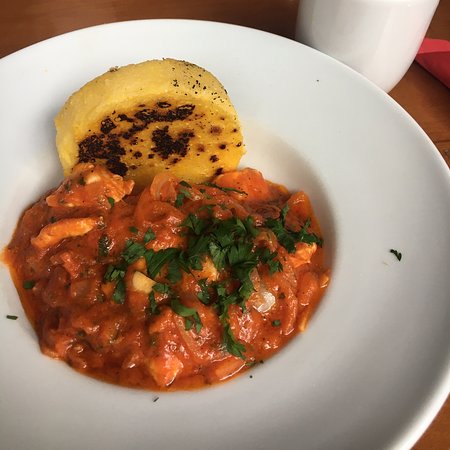
Locate an element on the screen. The height and width of the screenshot is (450, 450). white bowl edge is located at coordinates (376, 395).